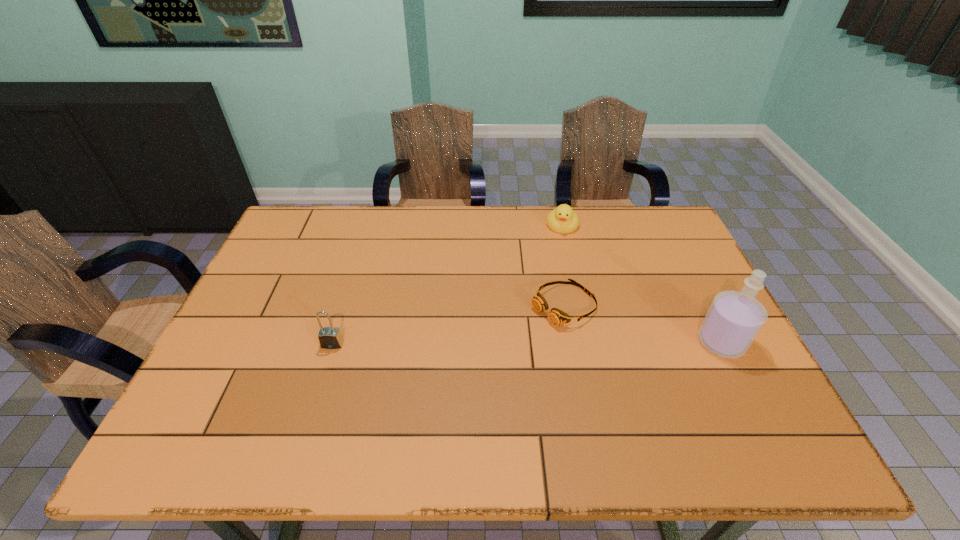
Where is `free point at the far left corner`? free point at the far left corner is located at coordinates (322, 219).

Locate an element on the screen. free space at the far right corner is located at coordinates (669, 217).

Identify the location of unoccupied area between the padlock and the duckling. The width and height of the screenshot is (960, 540). (447, 285).

This screenshot has height=540, width=960. Identify the location of unoccupied position between the leftmost object and the third tallest object. (447, 285).

Find the location of a particular element. The height and width of the screenshot is (540, 960). vacant area that lies between the padlock and the rightmost object is located at coordinates (527, 343).

What are the coordinates of `empty location between the rightmost object and the leftmost object` in the screenshot? It's located at (527, 343).

Where is `free space between the perfume and the farthest object`? free space between the perfume and the farthest object is located at coordinates point(641,284).

At what (x,y) coordinates should I click in order to perform the action: click on vacant point located between the shortest object and the duckling. Please return your answer as a coordinate pair (x, y). The image size is (960, 540). Looking at the image, I should click on (563, 265).

Identify the location of vacant area that lies between the padlock and the perfume. (527, 343).

Where is `free area in between the rightmost object and the shortest object`? The height and width of the screenshot is (540, 960). free area in between the rightmost object and the shortest object is located at coordinates (642, 323).